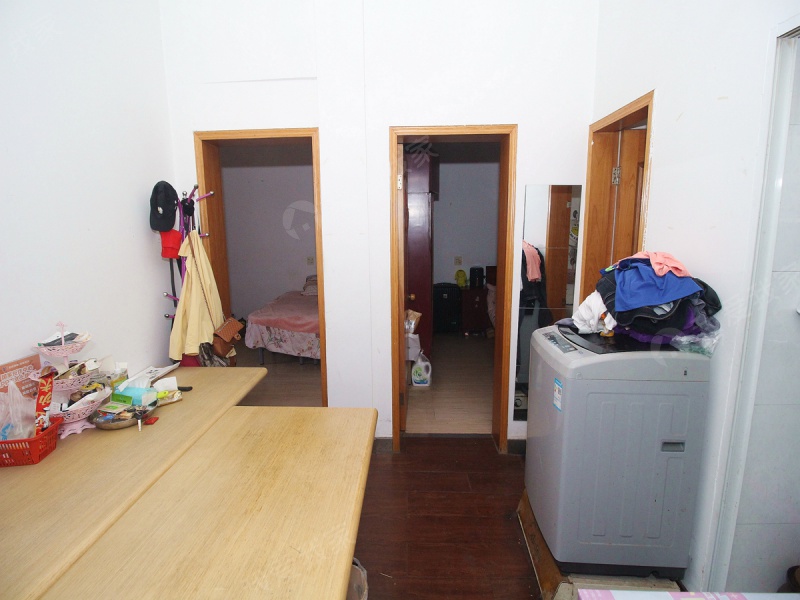
Where is `wooden border around the door`? wooden border around the door is located at coordinates (637, 110), (434, 127), (266, 125).